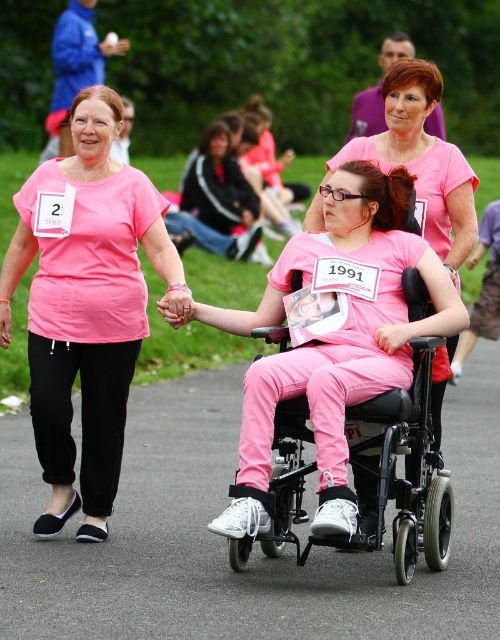
Can you confirm if pink fabric pants at center is taller than pink matte wheelchair at center?

No.

Is pink fabric pants at center smaller than pink matte wheelchair at center?

Indeed, pink fabric pants at center has a smaller size compared to pink matte wheelchair at center.

Locate an element on the screen. pink fabric pants at center is located at coordinates (224, 540).

Locate an element on the screen. The image size is (500, 640). pink fabric pants at center is located at coordinates (224, 540).

Is point (133, 506) behind point (43, 419)?

Yes, it is behind point (43, 419).

Can you confirm if pink fabric pants at center is positioned below matte pink shirt at left?

Yes.

Where is `pink fabric pants at center`? The image size is (500, 640). pink fabric pants at center is located at coordinates (224, 540).

Is pink fabric pants at center smaller than metallic black wheelchair at center?

Correct, pink fabric pants at center occupies less space than metallic black wheelchair at center.

Is pink fabric pants at center bigger than metallic black wheelchair at center?

Incorrect, pink fabric pants at center is not larger than metallic black wheelchair at center.

Find the location of `pink fabric pants at center`. pink fabric pants at center is located at coordinates (224, 540).